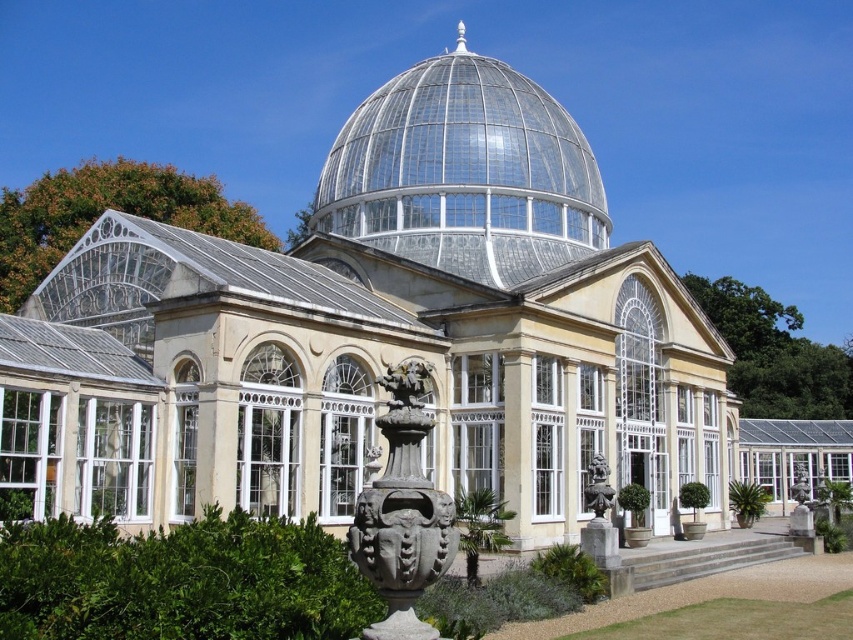
You are standing in front of the greenhouse and notice two points marked on the dome. The first point is at coordinates point [393,465] and the second is at point [589,464]. Which point is closer to you?

Point [393,465] is closer to the camera than point [589,464], so the first point is closer to you.

You are standing outside the greenhouse and want to reach a specific point marked at coordinates point (410, 509). If your current distance to that point is 92.24 feet, and you can walk at a speed of 3 feet per second, how many seconds will it take you to reach the point?

The distance to the point (410, 509) is 92.24 feet. At a walking speed of 3 feet per second, it will take 92.24 divided by 3, which is approximately 30.75 seconds to reach the point.

You are an architect designing a new greenhouse. You have a transparent glass dome at center and a matte stone statue at lower center. Which object has a greater width?

The transparent glass dome at center has a greater width than the matte stone statue at lower center.